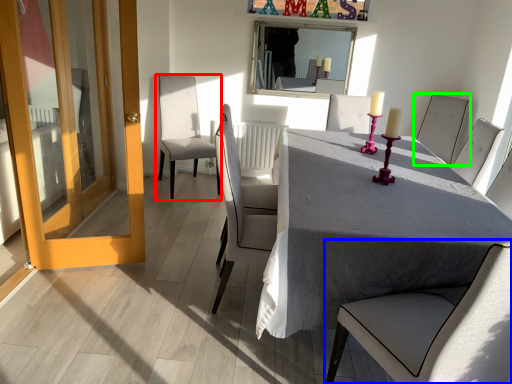
Question: Which is farther away from chair (highlighted by a red box)? chair (highlighted by a blue box) or chair (highlighted by a green box)?

Choices:
 (A) chair
 (B) chair

Answer: (A)